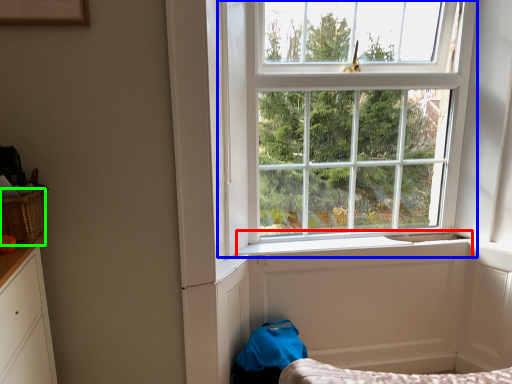
Question: Which object is positioned closest to window sill (highlighted by a red box)? Select from window (highlighted by a blue box) and basket (highlighted by a green box).

Choices:
 (A) window
 (B) basket

Answer: (A)